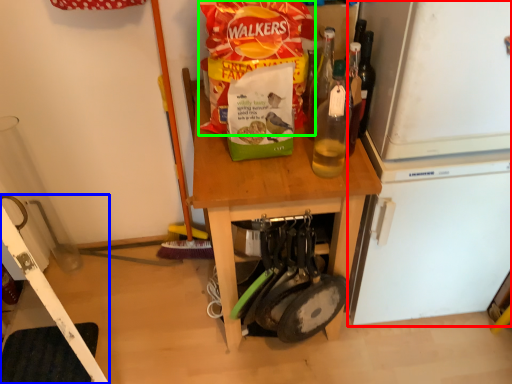
Question: Which is farther away from appliance (highlighted by a red box)? ladder (highlighted by a blue box) or cereal (highlighted by a green box)?

Choices:
 (A) ladder
 (B) cereal

Answer: (A)